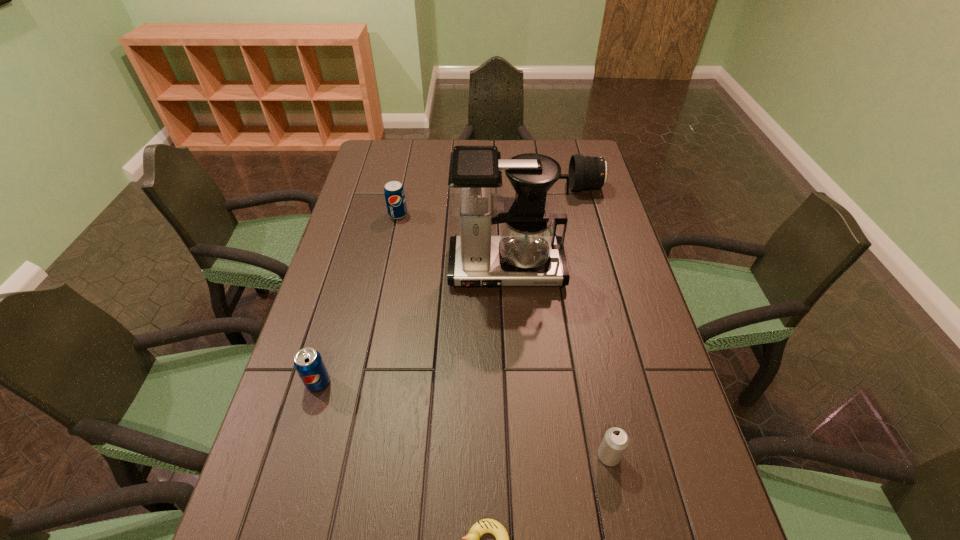
The height and width of the screenshot is (540, 960). What are the coordinates of `free spot located at the front of the tallest object where the controls are located` in the screenshot? It's located at (510, 340).

Locate an element on the screen. Image resolution: width=960 pixels, height=540 pixels. blank space located at the front element of the telephoto lens is located at coordinates (498, 188).

Image resolution: width=960 pixels, height=540 pixels. Identify the location of blank space located 0.050m at the front element of the telephoto lens. (556, 188).

This screenshot has height=540, width=960. I want to click on vacant space located at the front element of the telephoto lens, so click(507, 188).

Where is `vacant region located 0.210m on the front of the farther pop soda`? The width and height of the screenshot is (960, 540). vacant region located 0.210m on the front of the farther pop soda is located at coordinates (388, 264).

The width and height of the screenshot is (960, 540). What are the coordinates of `vacant region located on the right of the third nearest object` in the screenshot? It's located at (456, 383).

Locate an element on the screen. This screenshot has height=540, width=960. blank space located 0.230m on the left of the beer can is located at coordinates (490, 456).

I want to click on telephoto lens positioned at the right edge, so click(587, 172).

Identify the location of beer can that is at the right edge. (615, 442).

Where is `vacant region at the far edge of the desktop`? The height and width of the screenshot is (540, 960). vacant region at the far edge of the desktop is located at coordinates (436, 155).